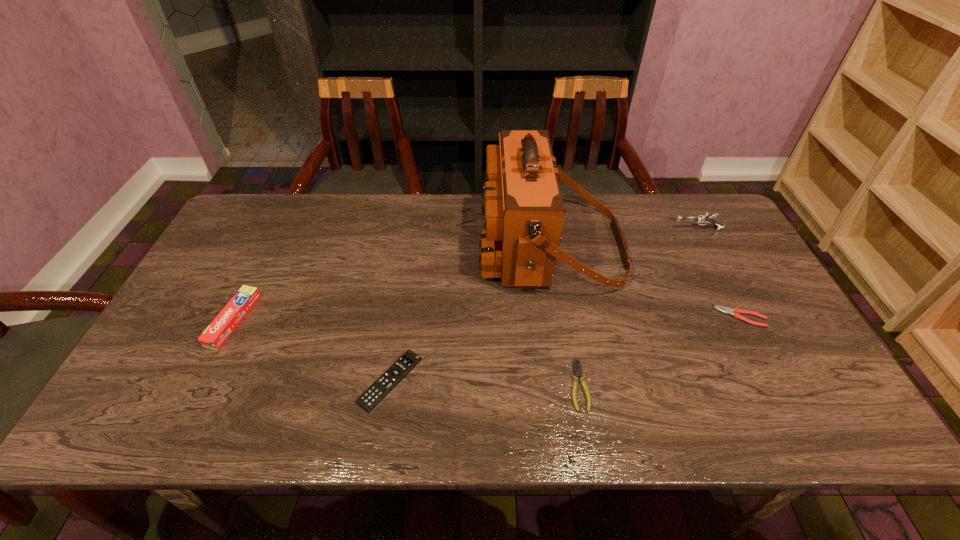
What are the coordinates of `blank space at the near left corner of the desktop` in the screenshot? It's located at (182, 413).

The image size is (960, 540). In the image, there is a desktop. What are the coordinates of `vacant space at the far right corner` in the screenshot? It's located at (683, 208).

This screenshot has width=960, height=540. In order to click on free spot between the remote control and the nearer pliers in this screenshot , I will do `click(485, 383)`.

Find the location of a particular element. The image size is (960, 540). unoccupied position between the satchel and the gun is located at coordinates (624, 238).

The width and height of the screenshot is (960, 540). I want to click on vacant area that lies between the left pliers and the remote control, so click(485, 383).

You are a GUI agent. You are given a task and a screenshot of the screen. Output one action in this format:
    pyautogui.click(x=<x>, y=<y>)
    Task: Click on the vacant space that's between the fifth object from right to left and the nearer pliers
    
    Given the screenshot: What is the action you would take?
    pyautogui.click(x=485, y=383)

The image size is (960, 540). What are the coordinates of `free spot between the nearer pliers and the fifth object from right to left` in the screenshot? It's located at (485, 383).

The image size is (960, 540). I want to click on free area in between the left pliers and the tallest object, so (x=564, y=316).

You are a GUI agent. You are given a task and a screenshot of the screen. Output one action in this format:
    pyautogui.click(x=<x>, y=<y>)
    Task: Click on the vacant point located between the right pliers and the satchel
    This screenshot has width=960, height=540.
    Given the screenshot: What is the action you would take?
    pyautogui.click(x=646, y=282)

Where is `free space between the toothpaste and the remote control`? free space between the toothpaste and the remote control is located at coordinates (312, 350).